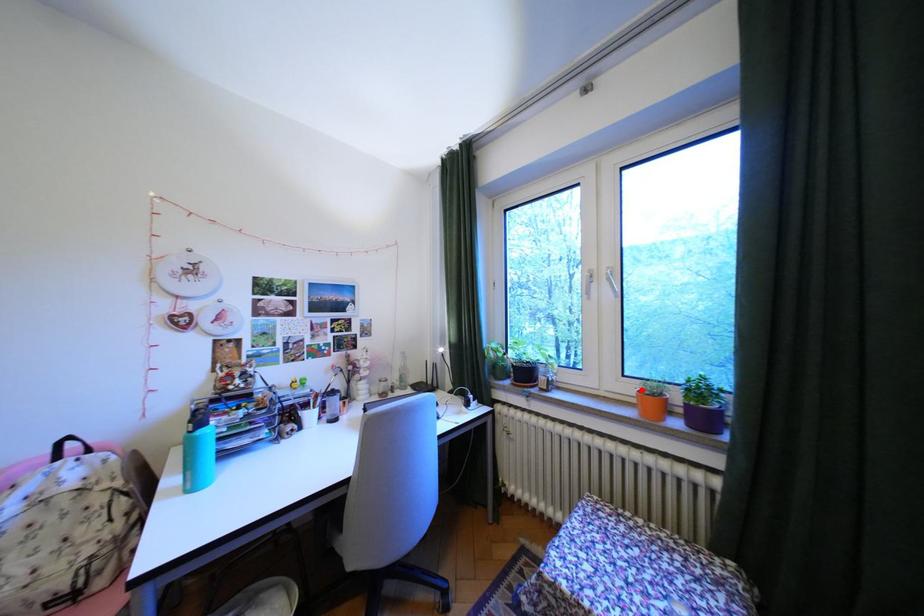
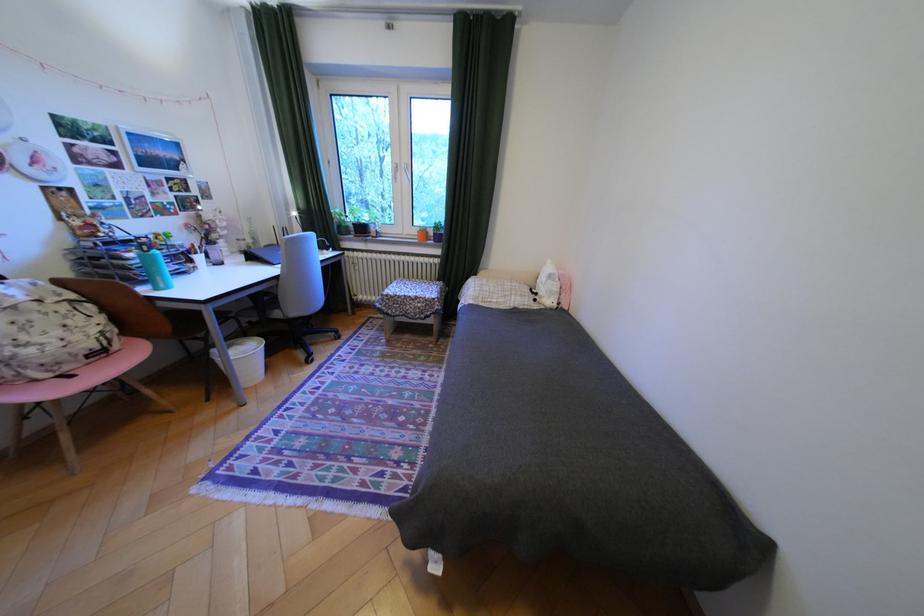
Question: I am providing you with two images of the same scene from different viewpoints. A red point is shown in image1. For the corresponding object point in image2, is it positioned nearer or farther from the camera?

Choices:
 (A) Nearer
 (B) Farther

Answer: (A)